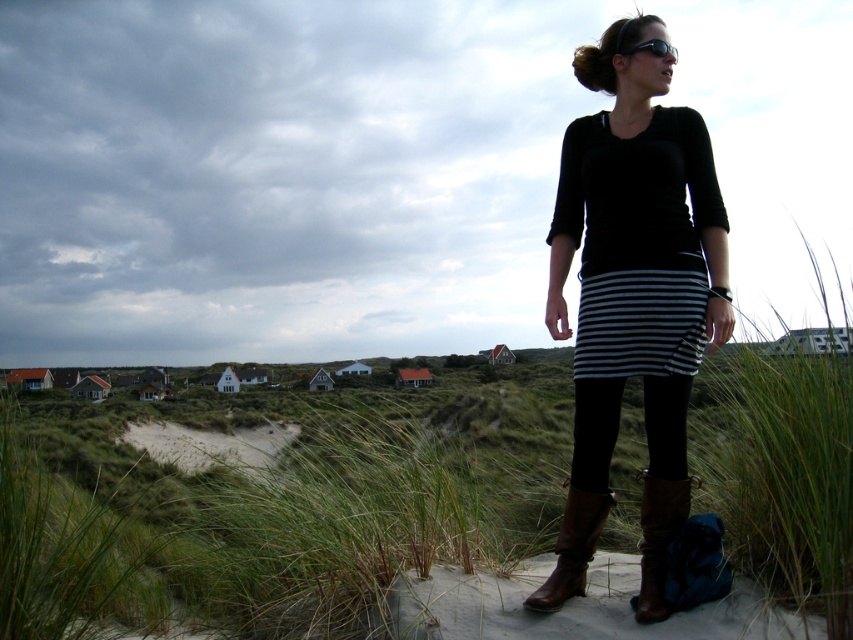
Question: Which point is farther to the camera?

Choices:
 (A) (578, 515)
 (B) (647, 566)
 (C) (653, 44)

Answer: (C)

Question: Which of the following is the farthest from the observer?

Choices:
 (A) (643, 144)
 (B) (637, 51)
 (C) (627, 209)
 (D) (639, 545)

Answer: (B)

Question: Can you confirm if black striped dress at center is thinner than brown leather boot at lower center?

Choices:
 (A) no
 (B) yes

Answer: (B)

Question: Can you confirm if brown leather boot at lower right is wider than black plastic goggles at upper center?

Choices:
 (A) no
 (B) yes

Answer: (B)

Question: Observing the image, what is the correct spatial positioning of brown leather boot at lower right in reference to black plastic goggles at upper center?

Choices:
 (A) below
 (B) above

Answer: (A)

Question: Estimate the real-world distances between objects in this image. Which object is closer to the black striped skirt at center?

Choices:
 (A) brown leather boot at lower center
 (B) brown leather boot at lower right

Answer: (B)